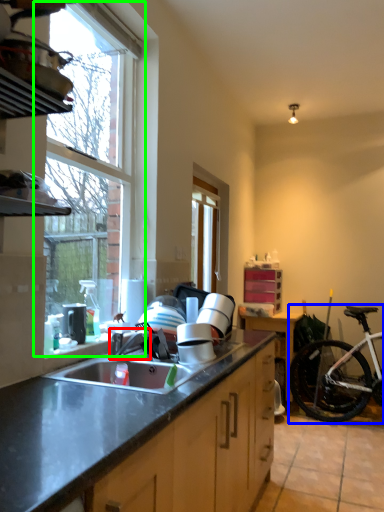
Question: Which object is positioned farthest from faucet (highlighted by a red box)? Select from bicycle (highlighted by a blue box) and window (highlighted by a green box).

Choices:
 (A) bicycle
 (B) window

Answer: (A)